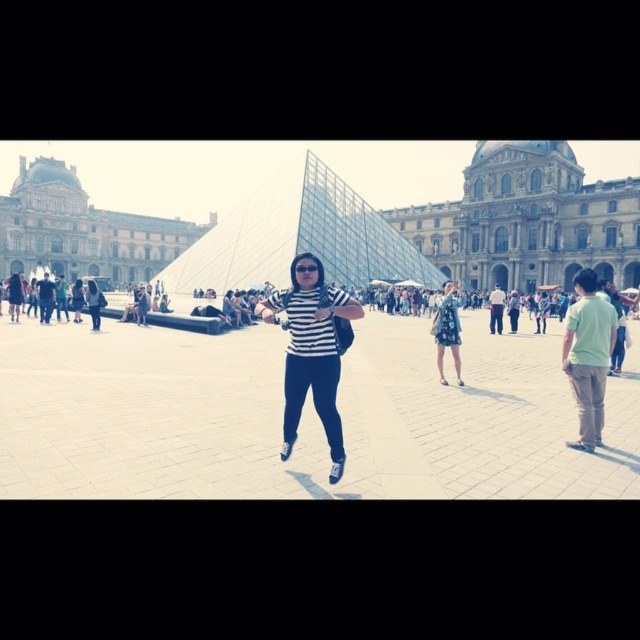
Question: Does stone facade building at center have a larger size compared to blue floral dress at center?

Choices:
 (A) no
 (B) yes

Answer: (B)

Question: Can you confirm if stone facade building at center is positioned below beige stone building at upper left?

Choices:
 (A) yes
 (B) no

Answer: (A)

Question: Is beige stone building at upper left behind blue floral dress at center?

Choices:
 (A) no
 (B) yes

Answer: (B)

Question: Which is nearer to the beige stone building at upper left?

Choices:
 (A) stone facade building at center
 (B) blue floral dress at center

Answer: (A)

Question: Which point is closer to the camera taking this photo?

Choices:
 (A) (458, 294)
 (B) (348, 314)

Answer: (B)

Question: Which object is positioned closest to the beige stone building at upper left?

Choices:
 (A) striped fabric at center
 (B) stone facade building at center
 (C) blue floral dress at center

Answer: (B)